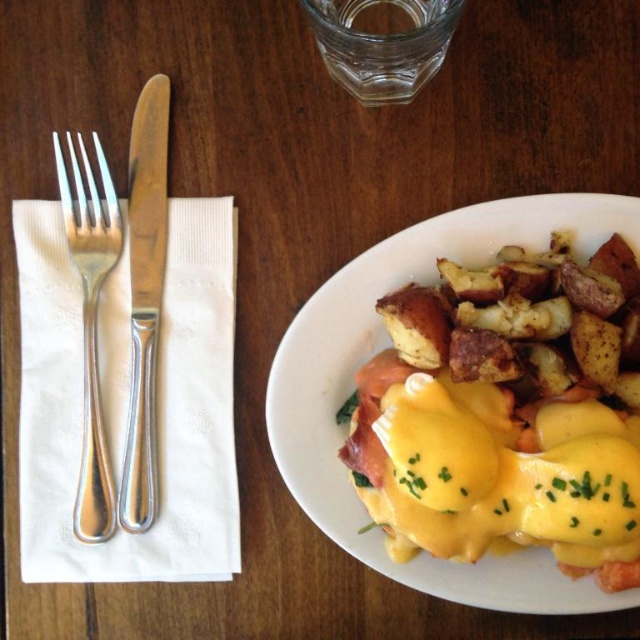
Can you confirm if yellow creamy hollandaise sauce at center is positioned above polished metal knife at left?

Actually, yellow creamy hollandaise sauce at center is below polished metal knife at left.

Find the location of a particular element. yellow creamy hollandaise sauce at center is located at coordinates (506, 412).

Which is in front, point (499, 534) or point (93, 307)?

Point (499, 534) is in front.

Does yellow creamy hollandaise sauce at center have a larger size compared to satin silver fork at left?

Correct, yellow creamy hollandaise sauce at center is larger in size than satin silver fork at left.

This screenshot has width=640, height=640. Describe the element at coordinates (506, 412) in the screenshot. I see `yellow creamy hollandaise sauce at center` at that location.

In order to click on yellow creamy hollandaise sauce at center in this screenshot , I will do pos(506,412).

Does polished metal knife at left have a greater width compared to satin silver fork at left?

No.

Does polished metal knife at left appear on the right side of satin silver fork at left?

Indeed, polished metal knife at left is positioned on the right side of satin silver fork at left.

Does point (150, 518) lie in front of point (90, 316)?

Yes, it is.

Find the location of a particular element. polished metal knife at left is located at coordinates (145, 298).